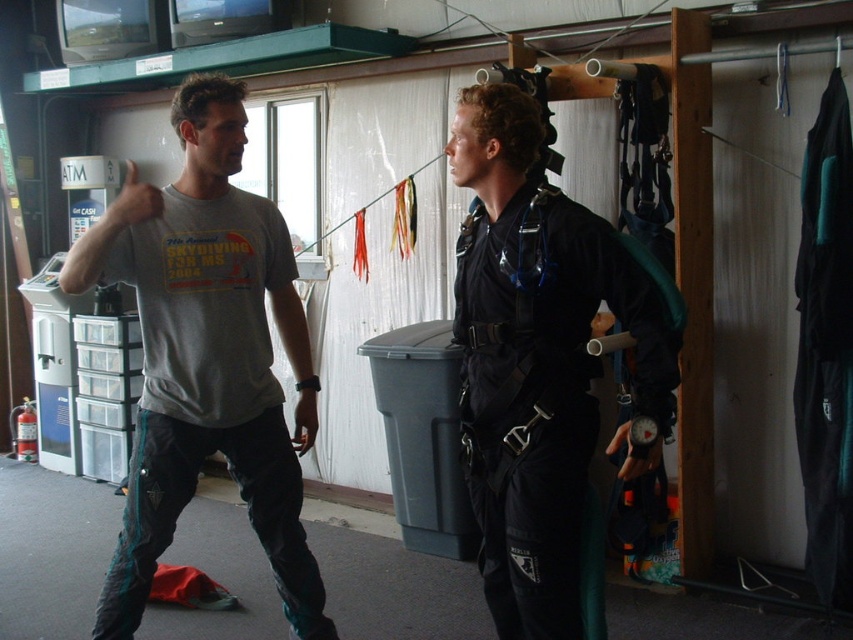
Please look at the coordinates point at the center of the image, which is point (543, 364). What object is located there?

The black matte diving suit at center is located at point (543, 364).

You are standing in the skydiving preparation area and want to reach a point that is exactly 6.50 feet away from you. The coordinates of this point are given as point (543,524). Can you confirm if this point is located within the area where the two individuals are positioned?

The point (543,524) is 6.50 feet away from the viewer, so yes, it is located within the area where the two individuals are positioned.